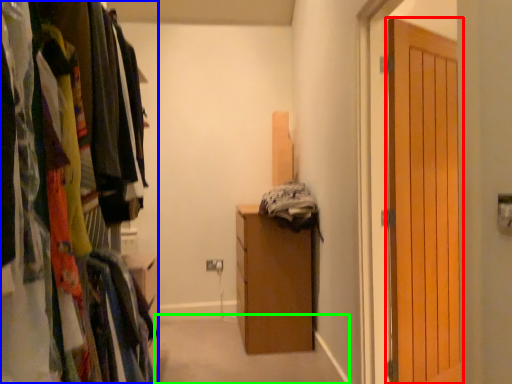
Question: Which object is the farthest from door (highlighted by a red box)? Choose among these: cabinetry (highlighted by a blue box) or path (highlighted by a green box).

Choices:
 (A) cabinetry
 (B) path

Answer: (A)